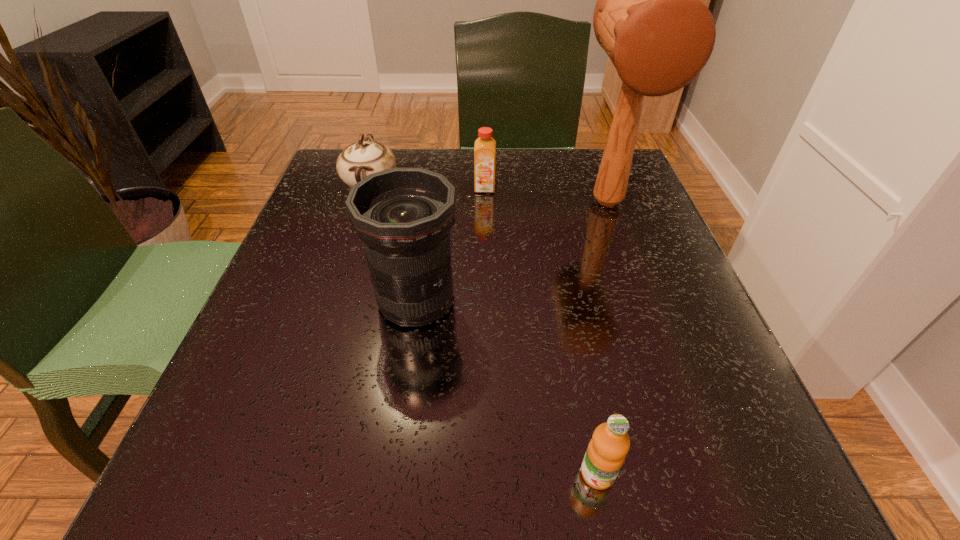
Locate an element on the screen. The width and height of the screenshot is (960, 540). object that is at the far right corner is located at coordinates (649, 18).

Image resolution: width=960 pixels, height=540 pixels. Find the location of `vacant space at the far edge of the desktop`. vacant space at the far edge of the desktop is located at coordinates coord(552,183).

The image size is (960, 540). I want to click on vacant space at the near edge of the desktop, so click(x=328, y=453).

What are the coordinates of `free region at the left edge` in the screenshot? It's located at (315, 339).

Where is `free region at the right edge of the desktop`? Image resolution: width=960 pixels, height=540 pixels. free region at the right edge of the desktop is located at coordinates (660, 319).

In the image, there is a desktop. Where is `vacant space at the far left corner`? The image size is (960, 540). vacant space at the far left corner is located at coordinates (337, 204).

Identify the location of free region at the near left corner of the desktop. This screenshot has height=540, width=960. coord(264,456).

You are a GUI agent. You are given a task and a screenshot of the screen. Output one action in this format:
    pyautogui.click(x=<x>, y=<y>)
    Task: Click on the vacant point at the far right corner
    Image resolution: width=960 pixels, height=540 pixels.
    Given the screenshot: What is the action you would take?
    pyautogui.click(x=573, y=172)

The image size is (960, 540). I want to click on free spot between the mallet and the leftmost object, so click(x=490, y=194).

At what (x,y) coordinates should I click in order to perform the action: click on free space that is in between the mallet and the fourth object from left to right. Please return your answer as a coordinate pair (x, y). The width and height of the screenshot is (960, 540). Looking at the image, I should click on (603, 338).